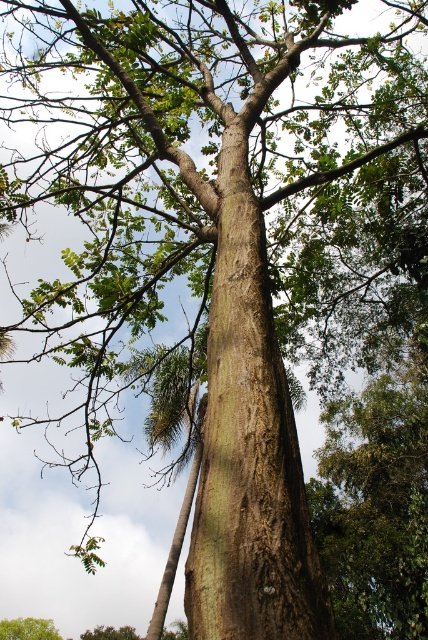
Consider the image. You are a bird looking for a nesting spot. You see the smooth brown bark at center and the green rough bark tree at lower left. Which one is taller?

The smooth brown bark at center is much taller than the green rough bark tree at lower left, so the bird should choose the smooth brown bark at center for nesting.

You are a botanist examining the tree from the base. You notice two distinct sections of bark on the tree. The smooth brown bark at center and the green rough bark tree at lower left. Which section is narrower in width?

The smooth brown bark at center has a lesser width compared to the green rough bark tree at lower left, so the smooth brown bark at center is narrower in width.

Based on the photo, you are a botanist examining the tree structure in the image. You notice the smooth brown bark at center and the green rough bark tree at lower left. Which of these two has a larger surface area?

The green rough bark tree at lower left has a larger surface area because it is bigger in size than the smooth brown bark at center.